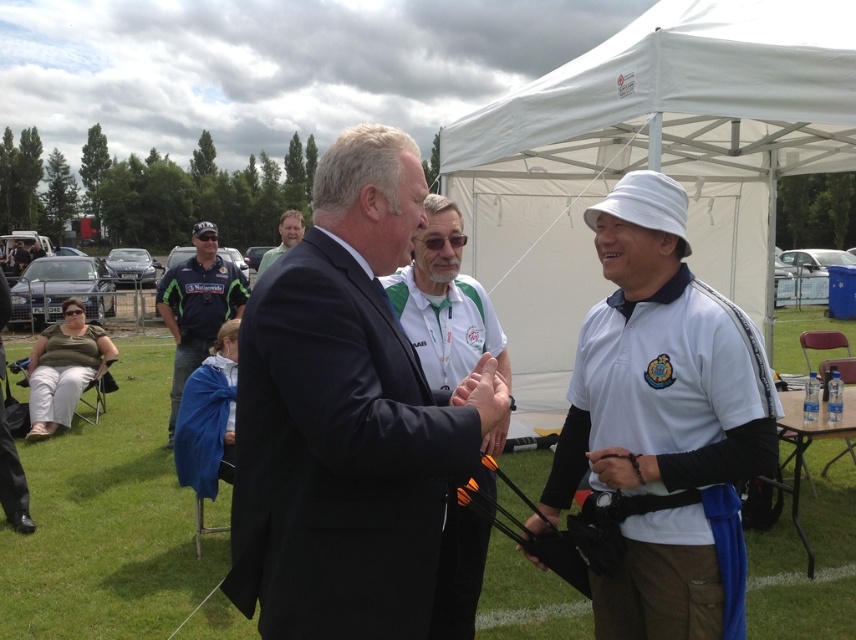
Question: Does black suit at center appear on the right side of white fabric tent at upper center?

Choices:
 (A) no
 (B) yes

Answer: (A)

Question: Which of these objects is positioned closest to the dark blue uniform at left?

Choices:
 (A) white matte hat at center
 (B) white fabric tent at upper center

Answer: (B)

Question: Among these points, which one is farthest from the camera?

Choices:
 (A) (177, 378)
 (B) (295, 237)

Answer: (A)

Question: Does white fabric tent at upper center have a larger size compared to dark suit at center?

Choices:
 (A) yes
 (B) no

Answer: (A)

Question: Which of the following is the closest to the observer?

Choices:
 (A) (484, 314)
 (B) (381, 260)

Answer: (B)

Question: Can you confirm if black suit at center is positioned below white matte hat at center?

Choices:
 (A) yes
 (B) no

Answer: (A)